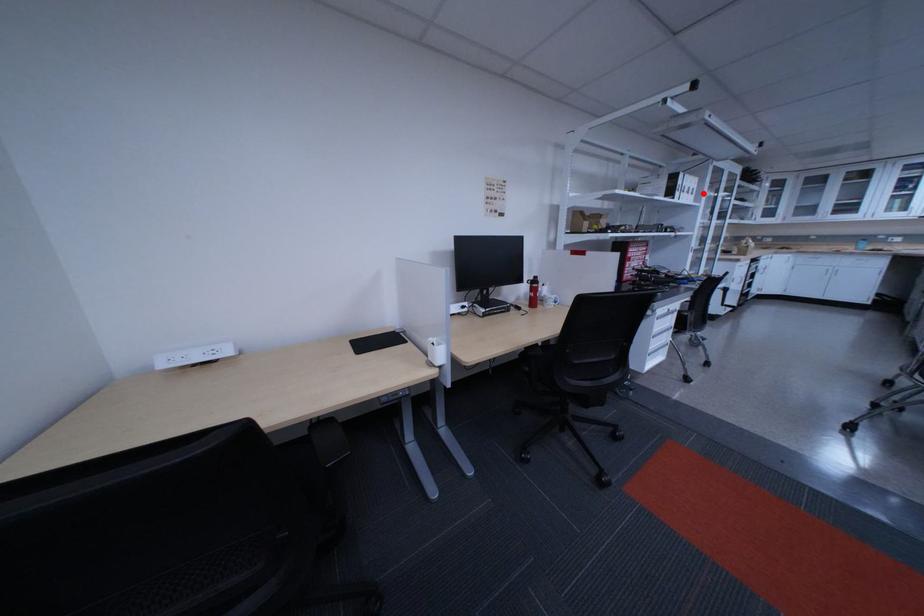
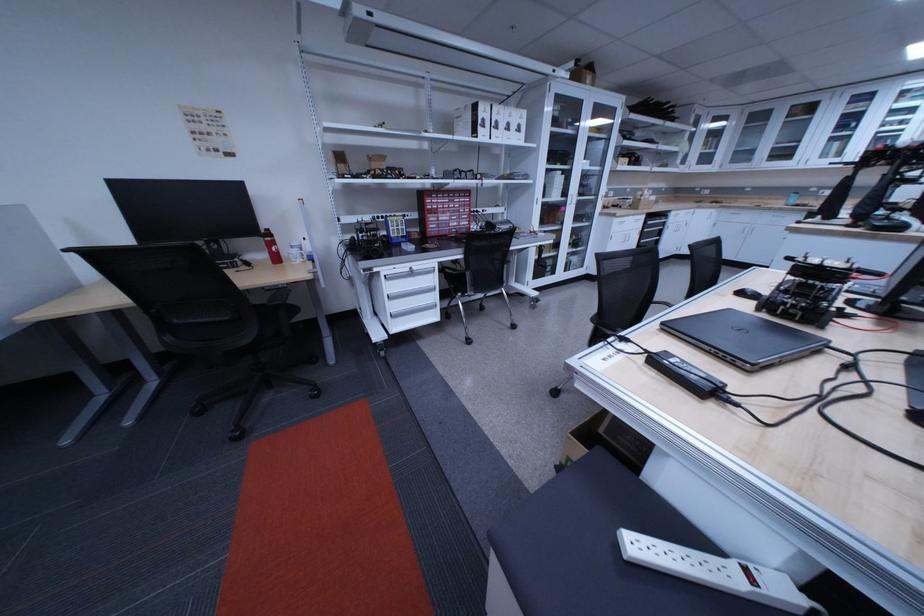
Locate, in the second image, the point that corresponds to the highlighted location in the first image.

(524, 130)